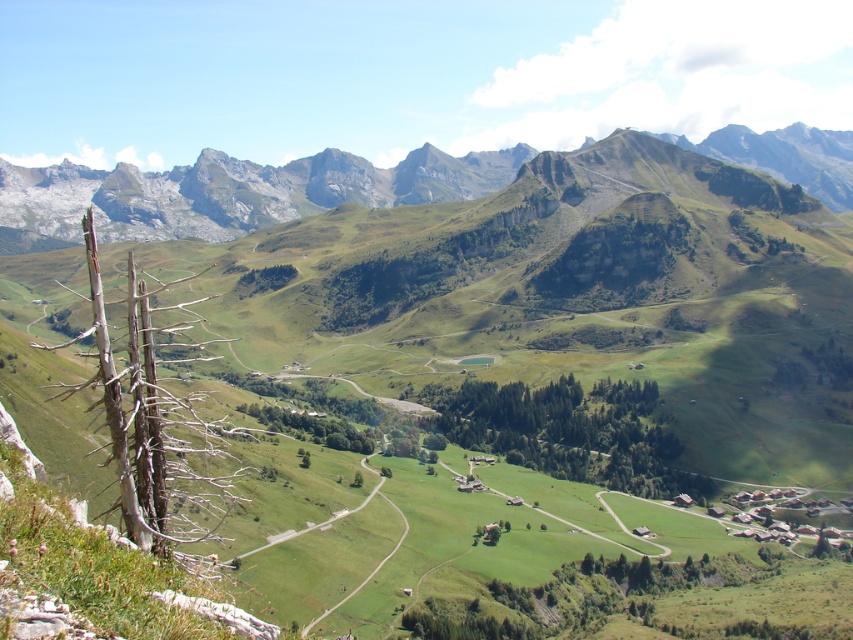
Question: Which point is farther to the camera?

Choices:
 (A) (526, 417)
 (B) (207, 340)
 (C) (236, 176)

Answer: (C)

Question: Which point is farther to the camera?

Choices:
 (A) rugged stone mountain range at upper center
 (B) dead wood at left
 (C) green leafy trees at center

Answer: (A)

Question: Is dead wood at left below green leafy trees at center?

Choices:
 (A) yes
 (B) no

Answer: (B)

Question: Is rugged stone mountain range at upper center wider than green leafy trees at center?

Choices:
 (A) no
 (B) yes

Answer: (B)

Question: Does rugged stone mountain range at upper center appear on the left side of green leafy trees at center?

Choices:
 (A) yes
 (B) no

Answer: (A)

Question: Which is nearer to the rugged stone mountain range at upper center?

Choices:
 (A) green leafy trees at center
 (B) dead wood at left

Answer: (A)